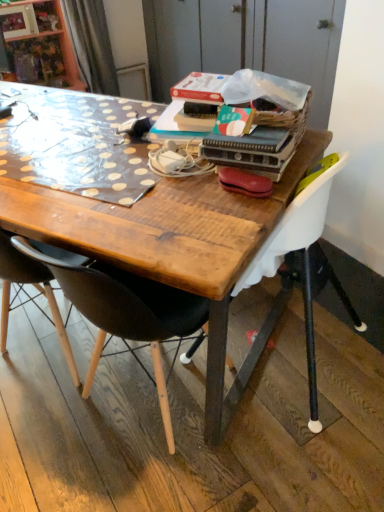
Image resolution: width=384 pixels, height=512 pixels. Identify the location of black plastic chair at center, which is the first chair from left to right. (126, 312).

Describe the element at coordinates (295, 225) in the screenshot. I see `white plastic chair at upper right, placed as the second chair when sorted from left to right` at that location.

Identify the location of black plastic chair at center, which is the first chair from left to right. The width and height of the screenshot is (384, 512). (126, 312).

Is black plastic chair at center, which is the first chair from left to right, not within white plastic chair at upper right, which is the 1th chair from right to left?

black plastic chair at center, which is the first chair from left to right, lies outside white plastic chair at upper right, which is the 1th chair from right to left,'s area.

What's the angular difference between black plastic chair at center, which appears as the 2th chair when viewed from the right, and white plastic chair at upper right, placed as the second chair when sorted from left to right,'s facing directions?

There is a 88.7-degree angle between the facing directions of black plastic chair at center, which appears as the 2th chair when viewed from the right, and white plastic chair at upper right, placed as the second chair when sorted from left to right.

From a real-world perspective, which object rests below the other?

black plastic chair at center, which appears as the 2th chair when viewed from the right, from a real-world perspective.

Can you confirm if leather-like brown handbag at center is positioned to the left of black plastic chair at center, which is the first chair from left to right?

Incorrect, leather-like brown handbag at center is not on the left side of black plastic chair at center, which is the first chair from left to right.

Which of these two, leather-like brown handbag at center or black plastic chair at center, which is the first chair from left to right, is thinner?

leather-like brown handbag at center.

Measure the distance from leather-like brown handbag at center to black plastic chair at center, which is the first chair from left to right.

leather-like brown handbag at center is 17.31 inches from black plastic chair at center, which is the first chair from left to right.

Considering the sizes of objects leather-like brown handbag at center and black plastic chair at center, which appears as the 2th chair when viewed from the right, in the image provided, who is smaller, leather-like brown handbag at center or black plastic chair at center, which appears as the 2th chair when viewed from the right,?

leather-like brown handbag at center is smaller.

Is leather-like brown handbag at center at the left side of white plastic chair at upper right, placed as the second chair when sorted from left to right?

Correct, you'll find leather-like brown handbag at center to the left of white plastic chair at upper right, placed as the second chair when sorted from left to right.

From the image's perspective, which chair is the 1st one below the leather-like brown handbag at center? Please provide its 2D coordinates.

[(295, 225)]

From the picture: Which of these two, leather-like brown handbag at center or white plastic chair at upper right, placed as the second chair when sorted from left to right, is bigger?

white plastic chair at upper right, placed as the second chair when sorted from left to right, is bigger.

What's the angular difference between wooden desk at center and black plastic chair at center, which appears as the 2th chair when viewed from the right,'s facing directions?

wooden desk at center and black plastic chair at center, which appears as the 2th chair when viewed from the right, are facing 176 degrees away from each other.

Considering the points (28, 233) and (200, 303), which point is in front, point (28, 233) or point (200, 303)?

The point (28, 233) is closer.

Consider the image. Which of these two, wooden desk at center or black plastic chair at center, which is the first chair from left to right, is thinner?

black plastic chair at center, which is the first chair from left to right.

Is wooden desk at center surrounding black plastic chair at center, which is the first chair from left to right?

Yes, black plastic chair at center, which is the first chair from left to right, is inside wooden desk at center.

Can you confirm if leather-like brown handbag at center is thinner than wooden desk at center?

Yes, leather-like brown handbag at center is thinner than wooden desk at center.

The image size is (384, 512). What are the coordinates of `desk that is below the leather-like brown handbag at center (from the image's perspective)` in the screenshot? It's located at tap(157, 229).

Which is correct: wooden desk at center is inside leather-like brown handbag at center, or outside of it?

wooden desk at center lies outside leather-like brown handbag at center.

Can you see wooden desk at center touching leather-like brown handbag at center?

No, wooden desk at center is not next to leather-like brown handbag at center.

Could you tell me if wooden desk at center is facing leather-like brown handbag at center?

No, wooden desk at center is not aimed at leather-like brown handbag at center.

At what (x,y) coordinates should I click in order to perform the action: click on desk on the left of leather-like brown handbag at center. Please return your answer as a coordinate pair (x, y). This screenshot has height=512, width=384. Looking at the image, I should click on (157, 229).

You are a GUI agent. You are given a task and a screenshot of the screen. Output one action in this format:
    pyautogui.click(x=<x>, y=<y>)
    Task: Click on the handbag behind the white plastic chair at upper right, which is the 1th chair from right to left
    The width and height of the screenshot is (384, 512).
    Given the screenshot: What is the action you would take?
    pyautogui.click(x=244, y=182)

Looking at this image, from a real-world perspective, which is physically below, white plastic chair at upper right, which is the 1th chair from right to left, or leather-like brown handbag at center?

From a 3D spatial view, white plastic chair at upper right, which is the 1th chair from right to left, is below.

From the image's perspective, does white plastic chair at upper right, placed as the second chair when sorted from left to right, appear lower than leather-like brown handbag at center?

Indeed, from the image's perspective, white plastic chair at upper right, placed as the second chair when sorted from left to right, is shown beneath leather-like brown handbag at center.

Considering the positions of point (323, 178) and point (241, 191), is point (323, 178) closer or farther from the camera than point (241, 191)?

Point (323, 178) is farther from the camera than point (241, 191).

The height and width of the screenshot is (512, 384). I want to click on chair below the white plastic chair at upper right, which is the 1th chair from right to left (from a real-world perspective), so click(x=126, y=312).

This screenshot has width=384, height=512. I want to click on the 2nd chair in front when counting from the leather-like brown handbag at center, so click(x=126, y=312).

Looking at the image, which one is located further to leather-like brown handbag at center, white plastic chair at upper right, which is the 1th chair from right to left, or black plastic chair at center, which is the first chair from left to right?

Among the two, black plastic chair at center, which is the first chair from left to right, is located further to leather-like brown handbag at center.

Considering their positions, is leather-like brown handbag at center positioned further to wooden desk at center than black plastic chair at center, which appears as the 2th chair when viewed from the right?

leather-like brown handbag at center is further to wooden desk at center.

Which object lies further to the anchor point white plastic chair at upper right, placed as the second chair when sorted from left to right, black plastic chair at center, which is the first chair from left to right, or leather-like brown handbag at center?

black plastic chair at center, which is the first chair from left to right, is positioned further to the anchor white plastic chair at upper right, placed as the second chair when sorted from left to right.

From the image, which object appears to be nearer to leather-like brown handbag at center, black plastic chair at center, which appears as the 2th chair when viewed from the right, or wooden desk at center?

wooden desk at center is closer to leather-like brown handbag at center.

When comparing their distances from wooden desk at center, does white plastic chair at upper right, placed as the second chair when sorted from left to right, or leather-like brown handbag at center seem closer?

white plastic chair at upper right, placed as the second chair when sorted from left to right, is closer to wooden desk at center.

Considering their positions, is white plastic chair at upper right, which is the 1th chair from right to left, positioned closer to black plastic chair at center, which appears as the 2th chair when viewed from the right, than wooden desk at center?

The object closer to black plastic chair at center, which appears as the 2th chair when viewed from the right, is wooden desk at center.

Looking at the image, which one is located further to white plastic chair at upper right, placed as the second chair when sorted from left to right, wooden desk at center or leather-like brown handbag at center?

wooden desk at center.

Based on the photo, based on their spatial positions, is black plastic chair at center, which appears as the 2th chair when viewed from the right, or wooden desk at center further from white plastic chair at upper right, which is the 1th chair from right to left?

wooden desk at center lies further to white plastic chair at upper right, which is the 1th chair from right to left, than the other object.

I want to click on handbag between wooden desk at center and white plastic chair at upper right, which is the 1th chair from right to left, so click(x=244, y=182).

This screenshot has height=512, width=384. Identify the location of chair situated between wooden desk at center and leather-like brown handbag at center from left to right. (126, 312).

Locate an element on the screen. This screenshot has height=512, width=384. chair between wooden desk at center and white plastic chair at upper right, placed as the second chair when sorted from left to right, from left to right is located at coordinates (126, 312).

Where is `handbag situated between black plastic chair at center, which appears as the 2th chair when viewed from the right, and white plastic chair at upper right, which is the 1th chair from right to left, from left to right`? The height and width of the screenshot is (512, 384). handbag situated between black plastic chair at center, which appears as the 2th chair when viewed from the right, and white plastic chair at upper right, which is the 1th chair from right to left, from left to right is located at coordinates (244, 182).